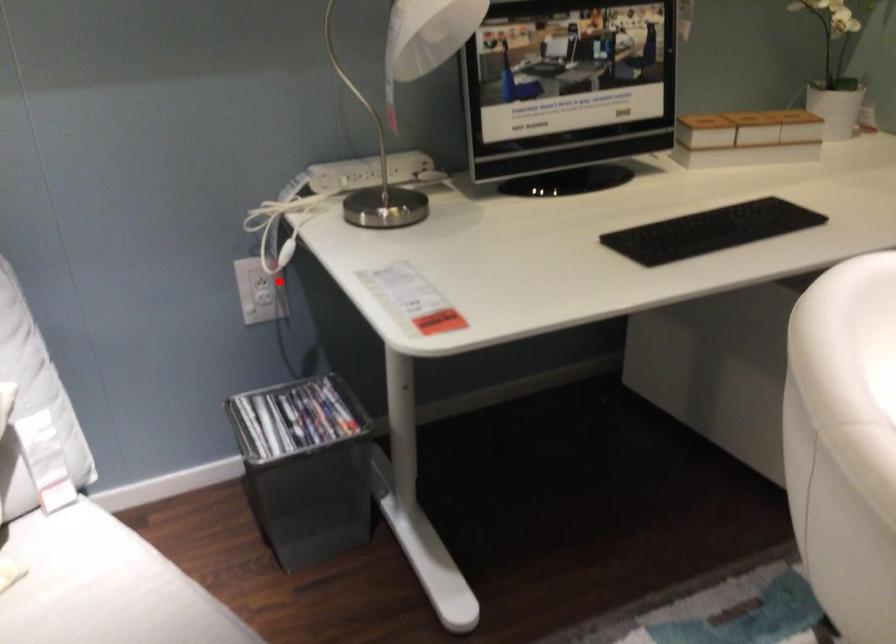
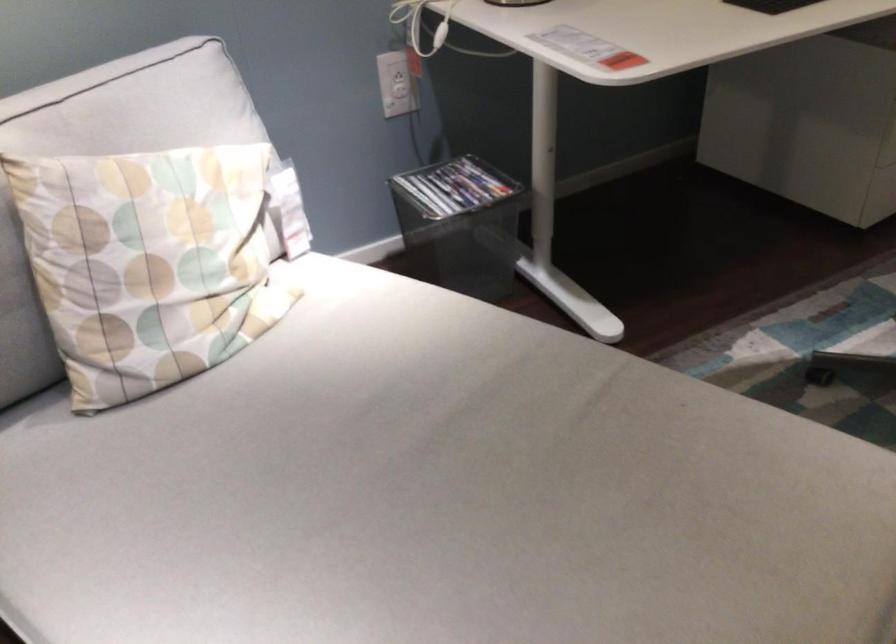
In the second image, find the point that corresponds to the highlighted location in the first image.

(398, 77)